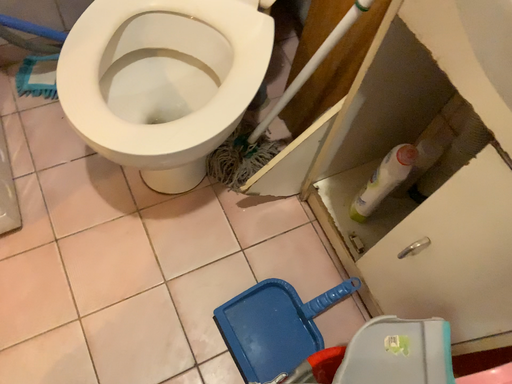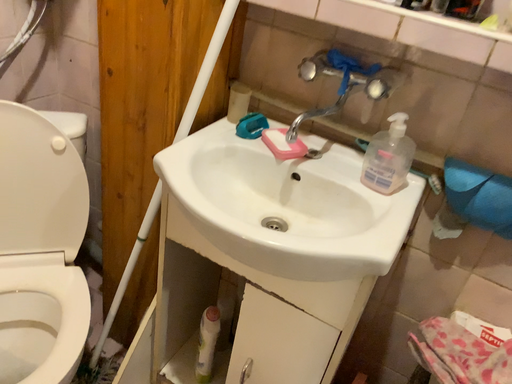
Question: How did the camera likely rotate when shooting the video?

Choices:
 (A) rotated right
 (B) rotated left

Answer: (A)